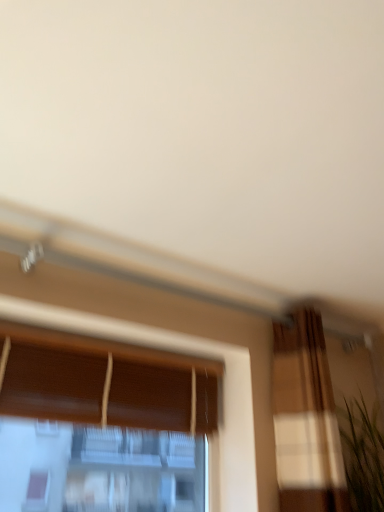
This screenshot has height=512, width=384. Describe the element at coordinates (362, 455) in the screenshot. I see `green matte plant at right` at that location.

The width and height of the screenshot is (384, 512). Find the location of `green matte plant at right`. green matte plant at right is located at coordinates (362, 455).

Locate an element on the screen. brown wood window at center is located at coordinates (104, 383).

The image size is (384, 512). What do you see at coordinates (104, 383) in the screenshot?
I see `brown wood window at center` at bounding box center [104, 383].

In order to click on green matte plant at right in this screenshot , I will do `click(362, 455)`.

Considering the relative positions of brown wood window at center and green matte plant at right in the image provided, is brown wood window at center to the right of green matte plant at right from the viewer's perspective?

Incorrect, brown wood window at center is not on the right side of green matte plant at right.

Which is in front, brown wood window at center or green matte plant at right?

Positioned in front is brown wood window at center.

Does point (21, 327) lie behind point (363, 508)?

That is False.

From the image's perspective, which object appears higher, brown wood window at center or green matte plant at right?

brown wood window at center is shown above in the image.

From a real-world perspective, between brown wood window at center and green matte plant at right, who is vertically lower?

green matte plant at right.

Is brown wood window at center thinner than green matte plant at right?

Indeed, brown wood window at center has a lesser width compared to green matte plant at right.

Which of these two, brown wood window at center or green matte plant at right, stands taller?

With more height is brown wood window at center.

From the picture: Does brown wood window at center have a smaller size compared to green matte plant at right?

No.

Looking at this image, is green matte plant at right a part of brown wood window at center?

That's incorrect, green matte plant at right is not inside brown wood window at center.

Are brown wood window at center and green matte plant at right located far from each other?

No, brown wood window at center is not far from green matte plant at right.

Is brown wood window at center facing towards green matte plant at right?

No, brown wood window at center is not turned towards green matte plant at right.

What are the coordinates of `window above the green matte plant at right (from the image's perspective)` in the screenshot? It's located at (104, 383).

Which is more to the right, green matte plant at right or brown wood window at center?

green matte plant at right.

In the image, is green matte plant at right positioned in front of or behind brown wood window at center?

green matte plant at right is positioned farther from the viewer than brown wood window at center.

Which is closer, (362, 475) or (194, 416)?

Clearly, point (362, 475) is closer to the camera than point (194, 416).

From the image's perspective, would you say green matte plant at right is positioned over brown wood window at center?

No, from the image's perspective, green matte plant at right is not above brown wood window at center.

From a real-world perspective, is green matte plant at right positioned under brown wood window at center based on gravity?

Indeed, from a real-world perspective, green matte plant at right is positioned beneath brown wood window at center.

Considering the relative sizes of green matte plant at right and brown wood window at center in the image provided, is green matte plant at right wider than brown wood window at center?

Yes, green matte plant at right is wider than brown wood window at center.

Can you confirm if green matte plant at right is shorter than brown wood window at center?

Correct, green matte plant at right is not as tall as brown wood window at center.

Does green matte plant at right have a smaller size compared to brown wood window at center?

Indeed, green matte plant at right has a smaller size compared to brown wood window at center.

Does green matte plant at right contain brown wood window at center?

No, brown wood window at center is located outside of green matte plant at right.

Is green matte plant at right positioned far away from brown wood window at center?

No, green matte plant at right is not far away from brown wood window at center.

Is green matte plant at right oriented towards brown wood window at center?

No, green matte plant at right is not aimed at brown wood window at center.

How far apart are green matte plant at right and brown wood window at center?

green matte plant at right and brown wood window at center are 31.37 inches apart from each other.

Locate an element on the screen. plant located underneath the brown wood window at center (from a real-world perspective) is located at coordinates (362, 455).

The width and height of the screenshot is (384, 512). What are the coordinates of `window on the left of the green matte plant at right` in the screenshot? It's located at (104, 383).

What are the coordinates of `plant below the brown wood window at center (from the image's perspective)` in the screenshot? It's located at (362, 455).